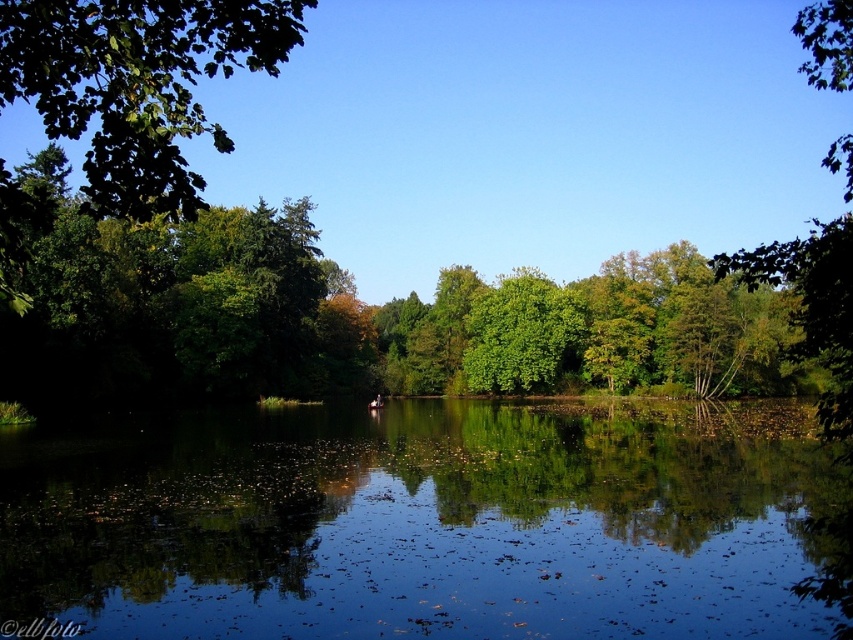
Can you confirm if green reflective water at center is smaller than green leafy tree at right?

Indeed, green reflective water at center has a smaller size compared to green leafy tree at right.

Find the location of a particular element. This screenshot has width=853, height=640. green reflective water at center is located at coordinates (407, 528).

What do you see at coordinates (407, 528) in the screenshot? I see `green reflective water at center` at bounding box center [407, 528].

Is green reflective water at center thinner than green leafy tree at upper left?

Yes, green reflective water at center is thinner than green leafy tree at upper left.

Is point (16, 564) behind point (152, 136)?

Yes, point (16, 564) is farther from viewer.

Find the location of a particular element. green reflective water at center is located at coordinates (407, 528).

Does point (86, 26) lie behind point (807, 280)?

Yes.

How distant is green leafy tree at upper left from green leafy tree at right?

green leafy tree at upper left is 102.20 meters from green leafy tree at right.

Between point (71, 44) and point (802, 276), which one is positioned behind?

Positioned behind is point (71, 44).

You are a GUI agent. You are given a task and a screenshot of the screen. Output one action in this format:
    pyautogui.click(x=<x>, y=<y>)
    Task: Click on the green leafy tree at upper left
    This screenshot has height=640, width=853.
    Given the screenshot: What is the action you would take?
    (x=137, y=83)